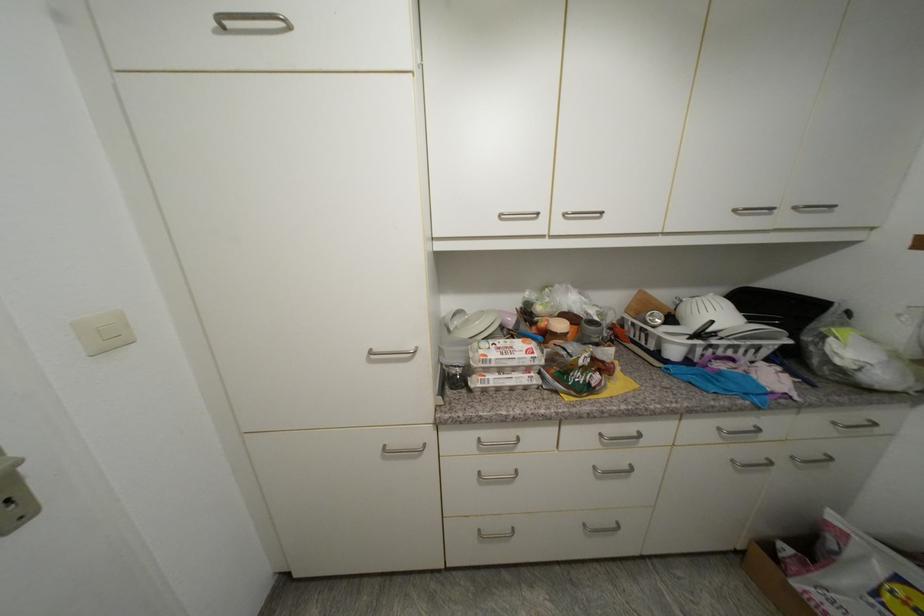
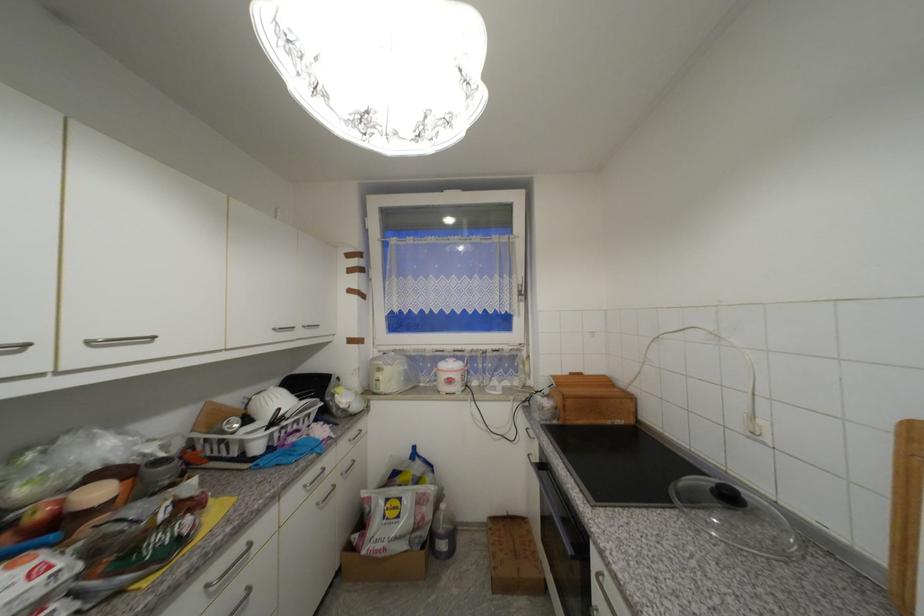
Locate, in the second image, the point that corresponds to (x=740, y=213) in the first image.

(281, 331)